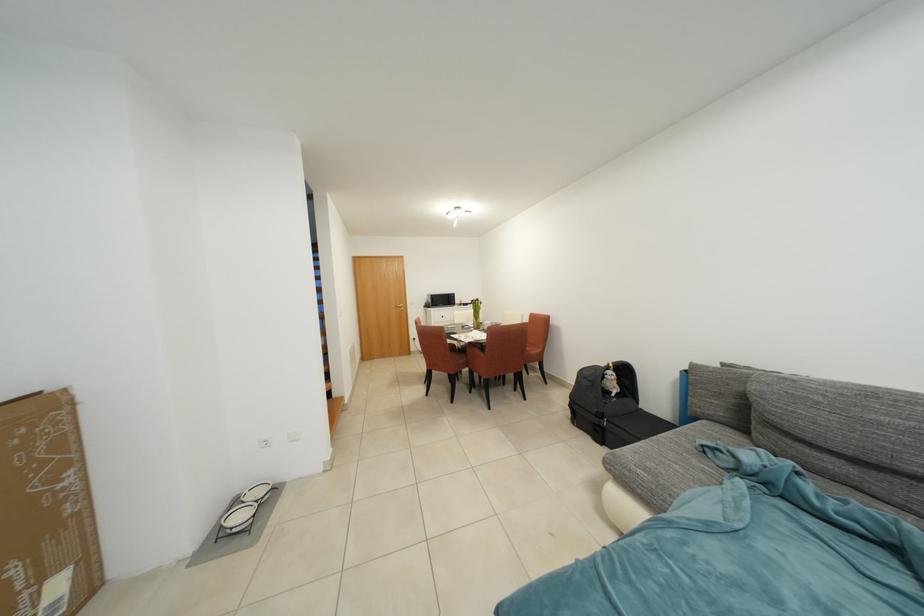
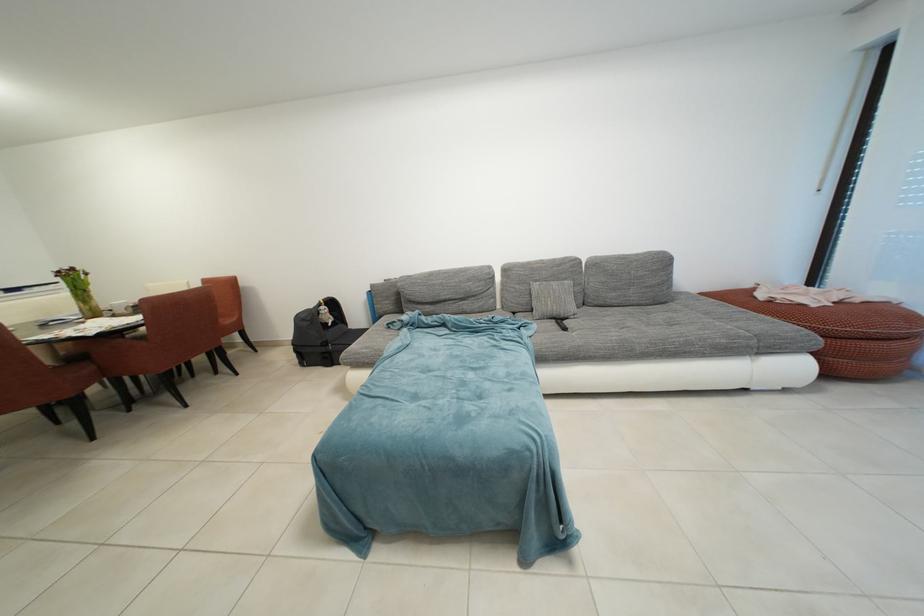
Where in the second image is the point corresponding to point (615, 371) from the first image?

(329, 309)